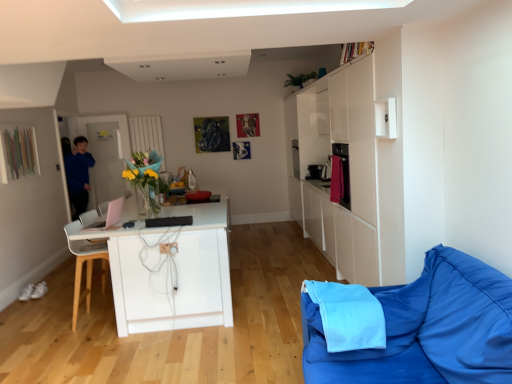
Question: In terms of width, does pink plastic laptop at center, acting as the second appliance starting from the right, look wider or thinner when compared to white wooden chair at left?

Choices:
 (A) thin
 (B) wide

Answer: (A)

Question: Is point (87, 216) positioned closer to the camera than point (90, 299)?

Choices:
 (A) farther
 (B) closer

Answer: (A)

Question: Based on their relative distances, which object is farther from the white wooden chair at left?

Choices:
 (A) black matte speaker at center, which is the 2th appliance from left to right
 (B) blue fabric at lower right
 (C) pink plastic laptop at center, placed as the second appliance when sorted from front to back
 (D) blue fabric couch at lower right

Answer: (D)

Question: Estimate the real-world distances between objects in this image. Which object is closer to the blue fabric couch at lower right?

Choices:
 (A) pink plastic laptop at center, placed as the second appliance when sorted from front to back
 (B) black matte speaker at center, which is the 2th appliance from left to right
 (C) white wooden chair at left
 (D) blue fabric at lower right

Answer: (D)